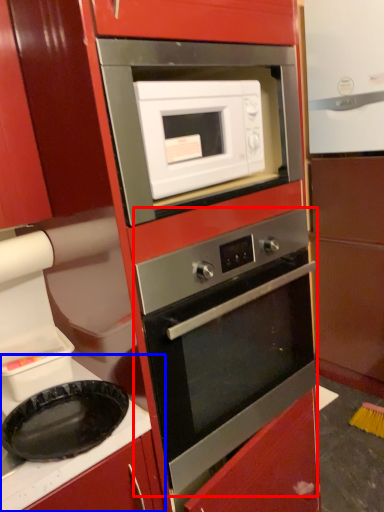
Question: Which of the following is the closest to the observer, oven (highlighted by a red box) or counter top (highlighted by a blue box)?

Choices:
 (A) oven
 (B) counter top

Answer: (B)